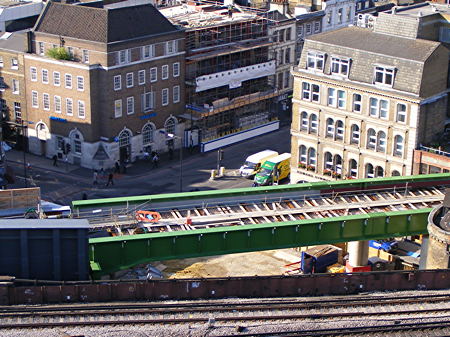
Identify the location of door. The image size is (450, 337). (42, 147), (125, 154).